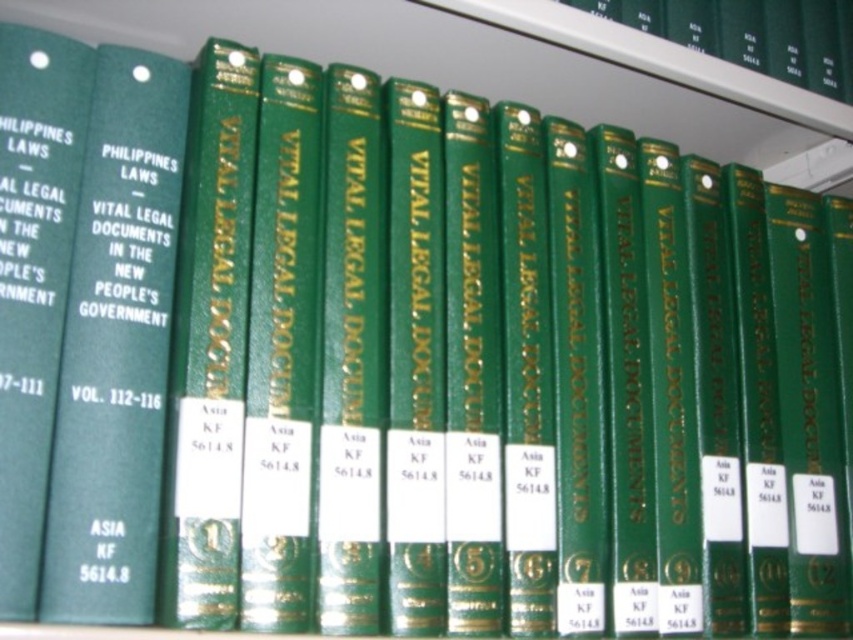
Question: Does green hardcover book at center have a greater width compared to green hardcover book at left?

Choices:
 (A) yes
 (B) no

Answer: (A)

Question: Can you confirm if green hardcover book at center is positioned to the right of green hardcover book at left?

Choices:
 (A) yes
 (B) no

Answer: (A)

Question: Is green hardcover book at center to the right of green hardcover book at left from the viewer's perspective?

Choices:
 (A) yes
 (B) no

Answer: (A)

Question: Which of the following is the closest to the observer?

Choices:
 (A) green hardcover book at left
 (B) green hardcover book at center

Answer: (A)

Question: Which object is farther from the camera taking this photo?

Choices:
 (A) green hardcover book at center
 (B) green hardcover book at left

Answer: (A)